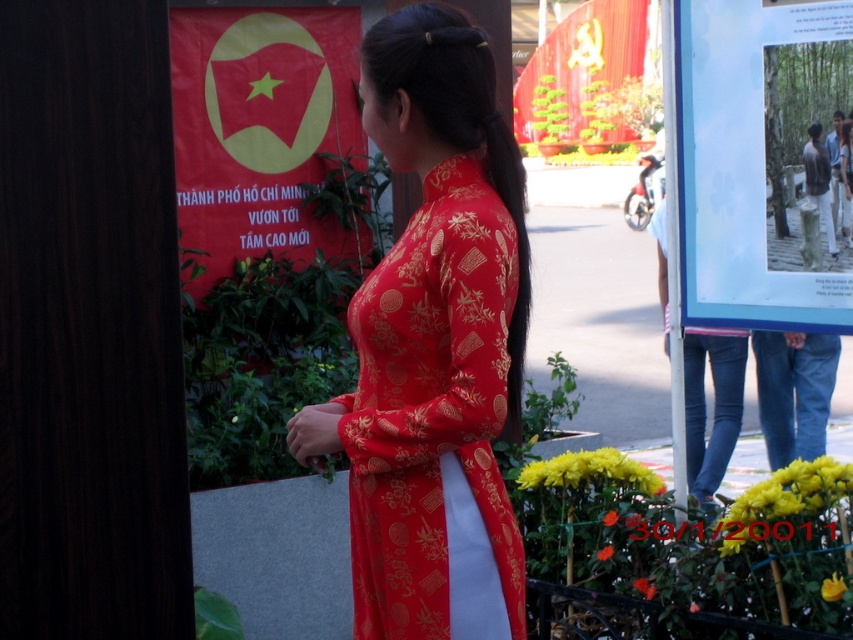
You are an event organizer planning to take a photo of the shiny brocade ao dai at center and the red matte poster at upper left. Which object should be placed higher in the photo to maintain their original positions?

The red matte poster at upper left should be placed higher in the photo since the shiny brocade ao dai at center is located below it in the original scene.

You are standing in the middle of the scene and want to take a photo of the shiny brocade ao dai at center and the red matte poster at upper left. How far apart are these two items from each other?

The shiny brocade ao dai at center is 9.63 feet away from the red matte poster at upper left.

You are a photographer at the event and want to capture the woman in the ao dai without any banners or posters in the foreground. Is the red matte poster at upper left blocking the view of the silky gold hair at center?

The red matte poster at upper left is above the silky gold hair at center, so it is not blocking the view of the silky gold hair at center from the photographer.